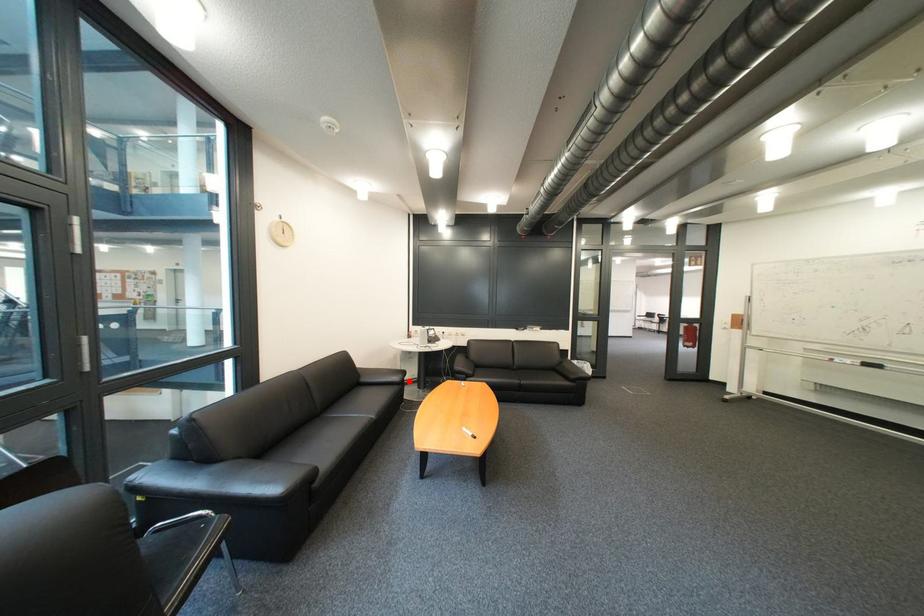
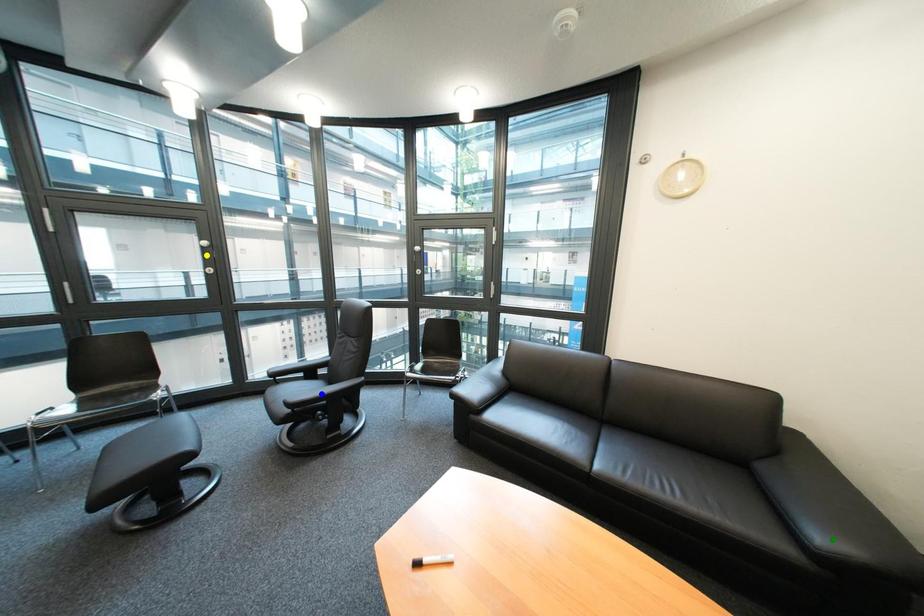
Question: I am providing you with two images of the same scene from different viewpoints. A red point is marked on the first image. You are given multiple points on the second image. Can you choose the point in image 2 that corresponds to the point in image 1?

Choices:
 (A) green point
 (B) yellow point
 (C) blue point

Answer: (A)